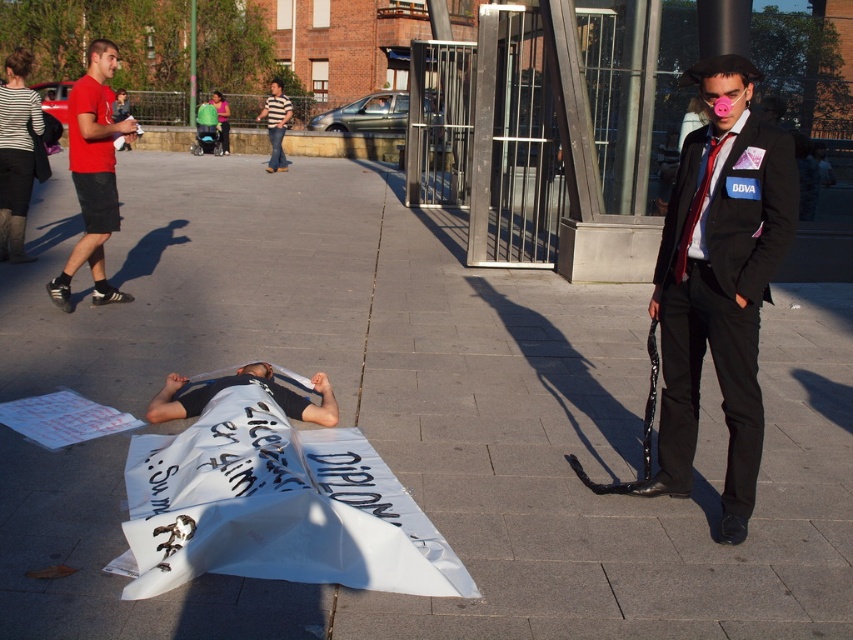
Does black suit at right have a larger size compared to striped fabric shirt at upper center?

No.

From the picture: Which is more to the right, black suit at right or striped fabric shirt at upper center?

Positioned to the right is black suit at right.

This screenshot has width=853, height=640. What do you see at coordinates (718, 280) in the screenshot?
I see `black suit at right` at bounding box center [718, 280].

Identify the location of black suit at right. The width and height of the screenshot is (853, 640). (718, 280).

Can you confirm if black suit at right is positioned above red cotton t-shirt at left?

No.

Is black suit at right positioned at the back of red cotton t-shirt at left?

No, black suit at right is closer to the viewer.

Who is more distant from viewer, (744, 480) or (94, 65)?

The point (94, 65) is behind.

Locate an element on the screen. This screenshot has height=640, width=853. black suit at right is located at coordinates (718, 280).

Which is in front, point (686, 248) or point (276, 156)?

Point (686, 248) is more forward.

Find the location of a particular element. The image size is (853, 640). red silk tie at right is located at coordinates (697, 205).

Is point (682, 244) more distant than point (277, 106)?

No, (682, 244) is in front of (277, 106).

Identify the location of red silk tie at right. (697, 205).